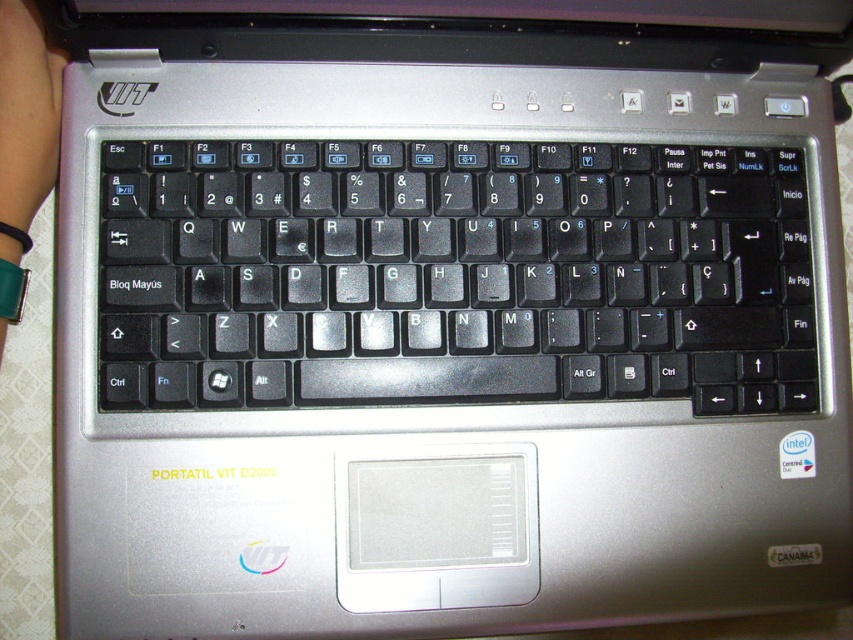
Question: Is black plastic keyboard at center to the right of green leather wristband at lower left from the viewer's perspective?

Choices:
 (A) no
 (B) yes

Answer: (B)

Question: Which point appears farthest from the camera in this image?

Choices:
 (A) (488, 243)
 (B) (20, 205)

Answer: (A)

Question: Is black plastic keyboard at center to the right of green leather wristband at lower left from the viewer's perspective?

Choices:
 (A) yes
 (B) no

Answer: (A)

Question: Which of the following is the closest to the observer?

Choices:
 (A) black plastic keyboard at center
 (B) green leather wristband at lower left

Answer: (B)

Question: Which object appears farthest from the camera in this image?

Choices:
 (A) black plastic keyboard at center
 (B) green leather wristband at lower left

Answer: (A)

Question: Is black plastic keyboard at center positioned before green leather wristband at lower left?

Choices:
 (A) yes
 (B) no

Answer: (B)